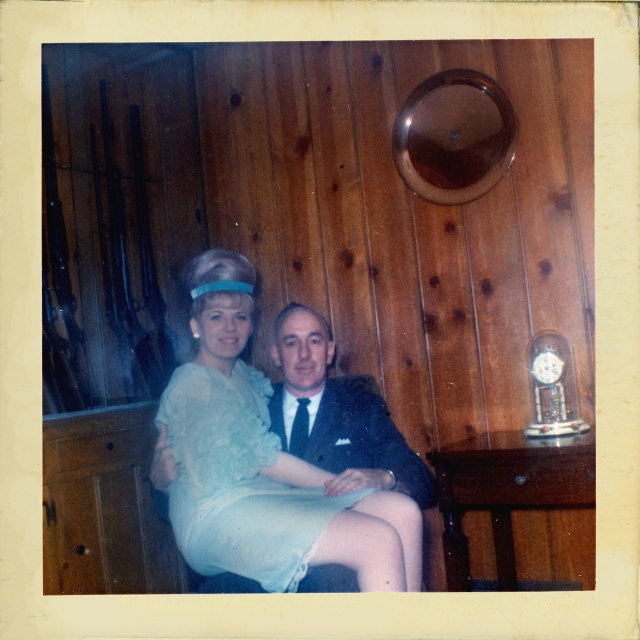
Between light blue lace dress at center and dark blue suit at center, which one is positioned higher?

Positioned higher is dark blue suit at center.

Does light blue lace dress at center appear on the left side of dark blue suit at center?

Correct, you'll find light blue lace dress at center to the left of dark blue suit at center.

Find the location of a particular element. light blue lace dress at center is located at coordinates (236, 481).